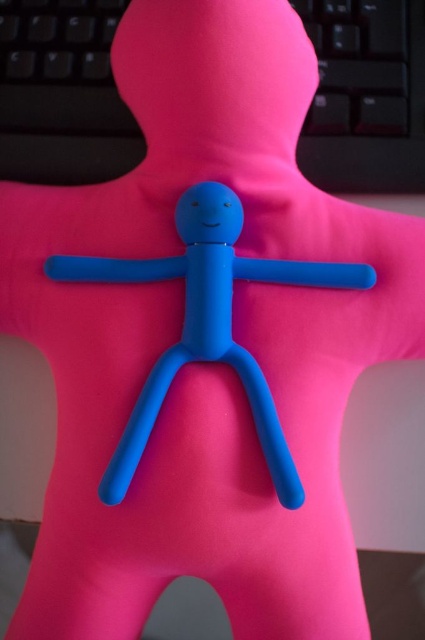
You are organizing a desk and need to place both the black plastic keyboard at upper center and the matte blue stick figure at center. Which object is taller so that it can be placed on top of the other?

The matte blue stick figure at center is taller than the black plastic keyboard at upper center, so it can be placed on top.

You are organizing a desk and see the black plastic keyboard at upper center and the matte blue stick figure at center. Which object is placed higher up in the image?

The black plastic keyboard at upper center is positioned over the matte blue stick figure at center, so it is placed higher up in the image.

What are the coordinates of the black plastic keyboard at upper center?

The coordinates of the black plastic keyboard at upper center are at point (61, 93).